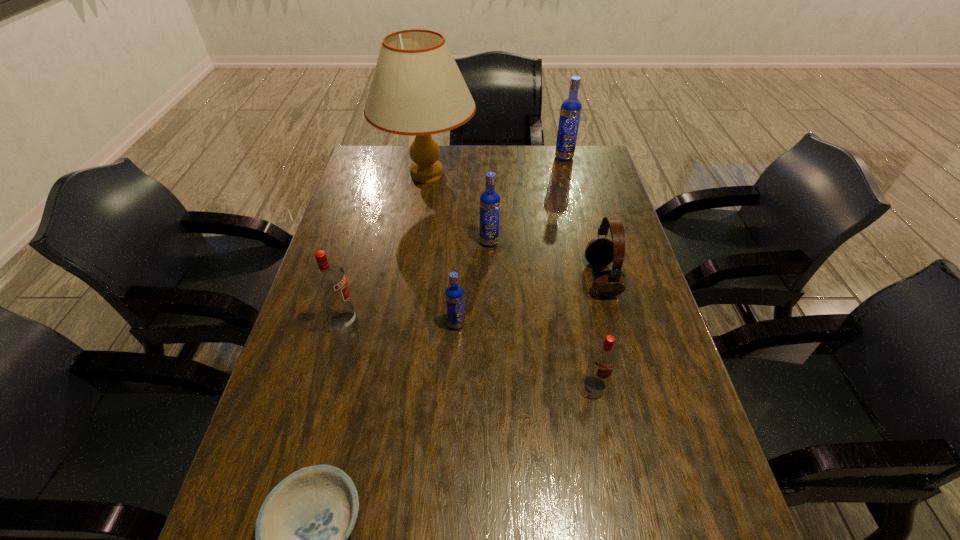
Identify the location of vacant region between the black headset and the second nearest blue vodka. Image resolution: width=960 pixels, height=540 pixels. (545, 260).

The image size is (960, 540). I want to click on free space between the lampshade and the farthest blue vodka, so click(495, 166).

The width and height of the screenshot is (960, 540). In order to click on free space between the fourth vodka from right to left and the farther red vodka in this screenshot , I will do `click(400, 323)`.

Find the location of a particular element. empty space that is in between the farther red vodka and the second farthest vodka is located at coordinates (417, 282).

This screenshot has height=540, width=960. What are the coordinates of `free space that is in between the left red vodka and the third vodka from right to left` in the screenshot? It's located at (417, 282).

Locate an element on the screen. object that is the second closest to the leftmost blue vodka is located at coordinates (489, 200).

You are a GUI agent. You are given a task and a screenshot of the screen. Output one action in this format:
    pyautogui.click(x=<x>, y=<y>)
    Task: Click on the object that is the third nearest to the smallest blue vodka
    
    Given the screenshot: What is the action you would take?
    pyautogui.click(x=604, y=356)

This screenshot has height=540, width=960. Identify the location of the second closest vodka to the nearest blue vodka. (489, 200).

Locate an element on the screen. The width and height of the screenshot is (960, 540). vodka that is the fourth nearest to the nearest blue vodka is located at coordinates (571, 108).

At what (x,y) coordinates should I click in order to perform the action: click on the closest blue vodka to the fourth farthest object. Please return your answer as a coordinate pair (x, y). This screenshot has height=540, width=960. Looking at the image, I should click on (489, 200).